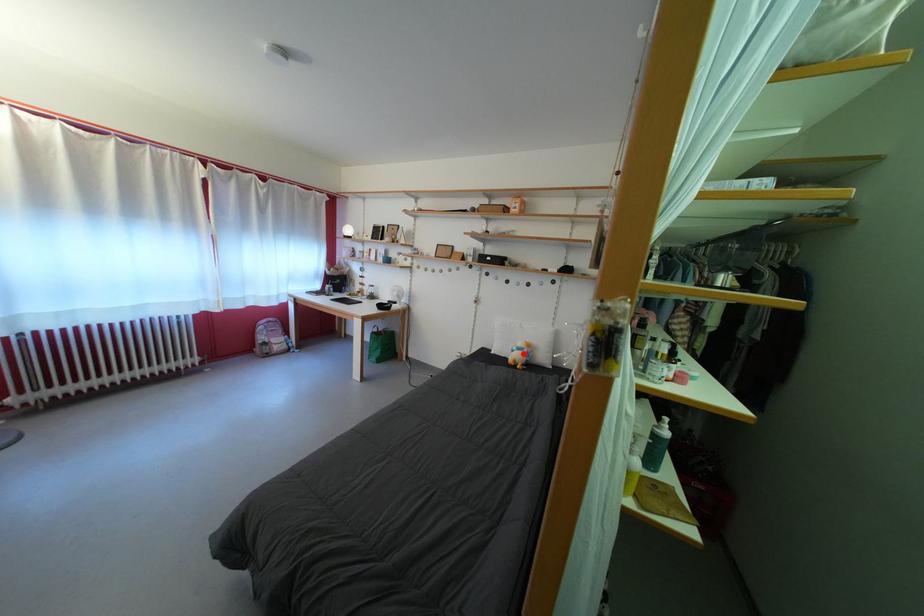
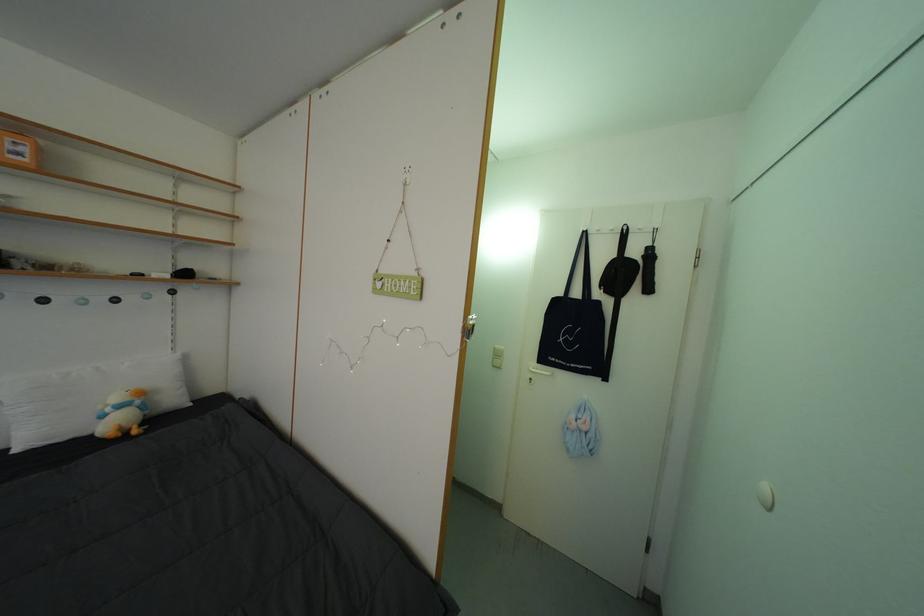
Question: I am providing you with two images of the same scene from different viewpoints. In image1, a red point is highlighted. Considering the same 3D point in image2, which of the following is correct?

Choices:
 (A) It is closer
 (B) It is farther

Answer: (A)